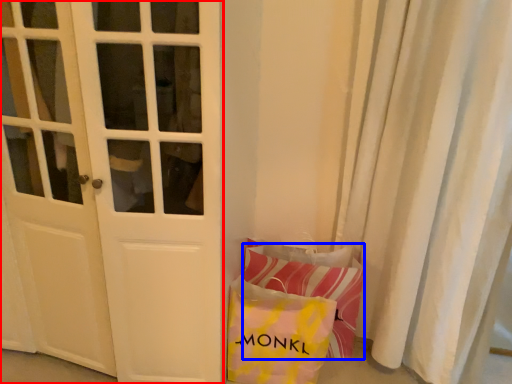
Question: Among these objects, which one is farthest to the camera, door (highlighted by a red box) or pillow (highlighted by a blue box)?

Choices:
 (A) door
 (B) pillow

Answer: (B)